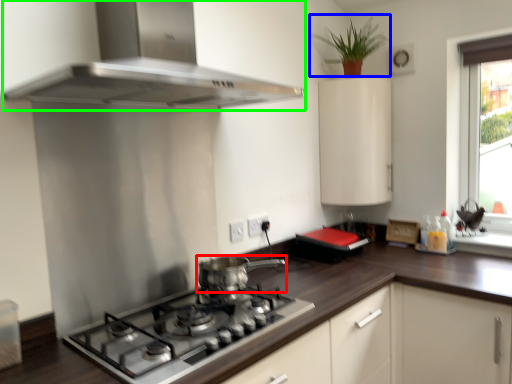
Question: Which object is positioned farthest from kitchen appliance (highlighted by a red box)? Select from plant (highlighted by a blue box) and home appliance (highlighted by a green box).

Choices:
 (A) plant
 (B) home appliance

Answer: (A)